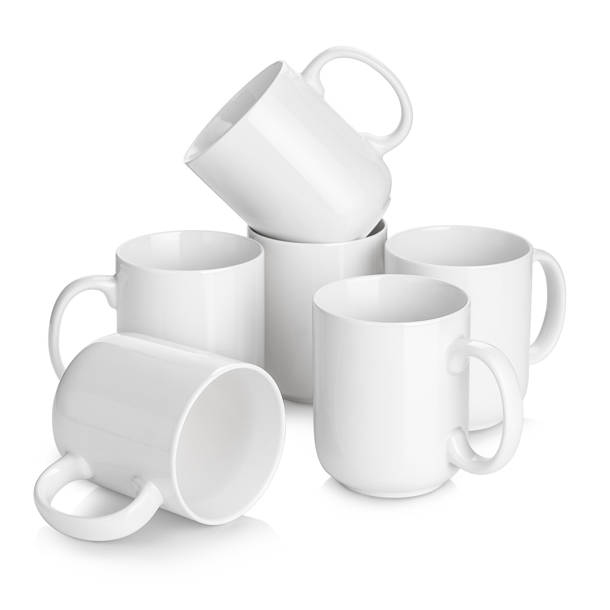
This screenshot has width=610, height=610. What are the coordinates of `cups` in the screenshot? It's located at (393, 407), (490, 310), (315, 155), (306, 273), (220, 296), (176, 404).